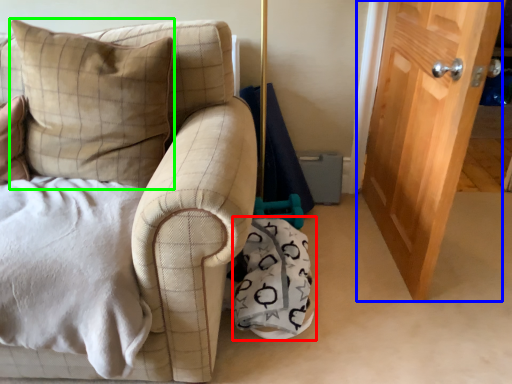
Question: Based on their relative distances, which object is farther from material (highlighted by a red box)? Choose from door (highlighted by a blue box) and pillow (highlighted by a green box).

Choices:
 (A) door
 (B) pillow

Answer: (B)